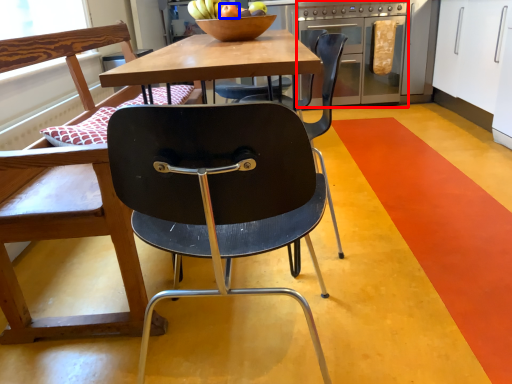
Question: Which of the following is the farthest to the observer, oven (highlighted by a red box) or apple (highlighted by a blue box)?

Choices:
 (A) oven
 (B) apple

Answer: (A)